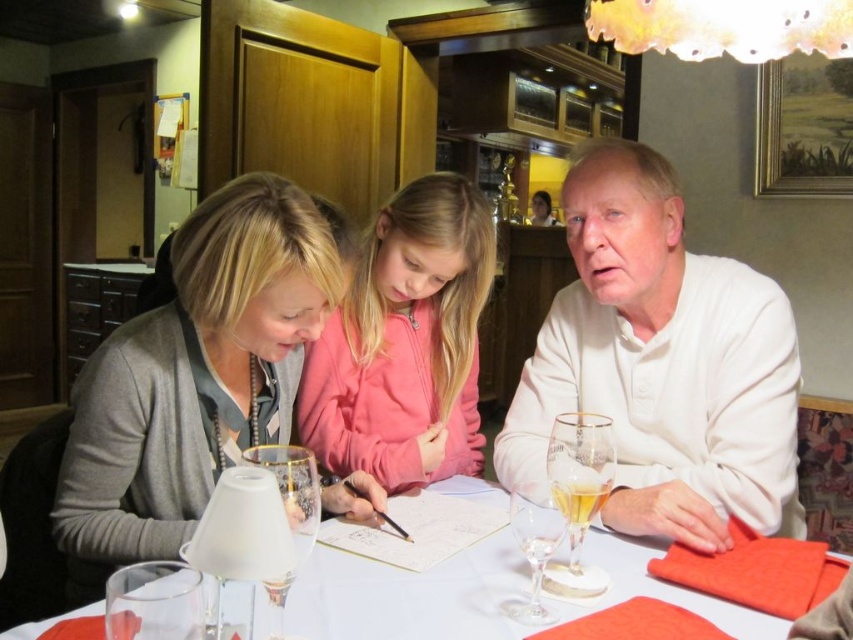
Which is more to the right, clear glass wine glass at table center or transparent glass wine glass at lower center?

Positioned to the right is transparent glass wine glass at lower center.

Is point (300, 506) farther from viewer compared to point (526, 528)?

No.

This screenshot has height=640, width=853. Identify the location of clear glass wine glass at table center. (289, 513).

How much distance is there between white matte shirt at right and clear glass wine glass at table center?

A distance of 30.01 inches exists between white matte shirt at right and clear glass wine glass at table center.

Who is higher up, white matte shirt at right or clear glass wine glass at table center?

Positioned higher is white matte shirt at right.

Between point (712, 547) and point (274, 624), which one is positioned in front?

Point (274, 624) is more forward.

Where is `white matte shirt at right`? The height and width of the screenshot is (640, 853). white matte shirt at right is located at coordinates (662, 364).

How far apart are translucent glass beer at right and clear glass wine glass at table center?

They are 15.18 inches apart.

Is translucent glass beer at right thinner than clear glass wine glass at table center?

No, translucent glass beer at right is not thinner than clear glass wine glass at table center.

Identify the location of translucent glass beer at right. The width and height of the screenshot is (853, 640). (578, 493).